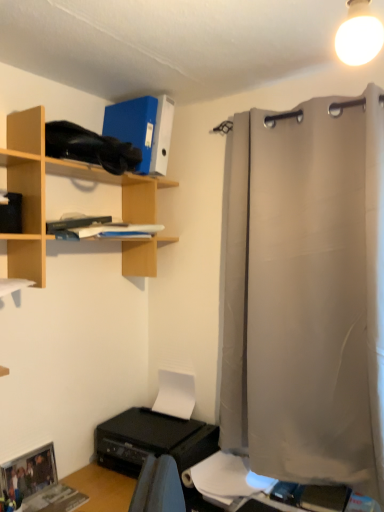
Question: Is wooden shelf at upper left smaller than light gray fabric curtain at right?

Choices:
 (A) no
 (B) yes

Answer: (B)

Question: Is wooden shelf at upper left next to light gray fabric curtain at right and touching it?

Choices:
 (A) yes
 (B) no

Answer: (B)

Question: Can you confirm if wooden shelf at upper left is positioned to the left of light gray fabric curtain at right?

Choices:
 (A) no
 (B) yes

Answer: (B)

Question: Does wooden shelf at upper left have a lesser height compared to light gray fabric curtain at right?

Choices:
 (A) no
 (B) yes

Answer: (B)

Question: Is the depth of wooden shelf at upper left greater than that of light gray fabric curtain at right?

Choices:
 (A) yes
 (B) no

Answer: (B)

Question: Does wooden shelf at upper left lie in front of light gray fabric curtain at right?

Choices:
 (A) yes
 (B) no

Answer: (A)

Question: From the image's perspective, is white glossy light bulb at upper right located beneath black plastic printer at lower left?

Choices:
 (A) no
 (B) yes

Answer: (A)

Question: From a real-world perspective, is white glossy light bulb at upper right on top of black plastic printer at lower left?

Choices:
 (A) yes
 (B) no

Answer: (A)

Question: Does white glossy light bulb at upper right lie in front of black plastic printer at lower left?

Choices:
 (A) yes
 (B) no

Answer: (A)

Question: Is the depth of white glossy light bulb at upper right greater than that of black plastic printer at lower left?

Choices:
 (A) no
 (B) yes

Answer: (A)

Question: Is white glossy light bulb at upper right positioned far away from black plastic printer at lower left?

Choices:
 (A) yes
 (B) no

Answer: (A)

Question: Can you confirm if white glossy light bulb at upper right is positioned to the left of black plastic printer at lower left?

Choices:
 (A) no
 (B) yes

Answer: (A)

Question: Is white matte paper at lower center facing away from light gray fabric curtain at right?

Choices:
 (A) no
 (B) yes

Answer: (A)